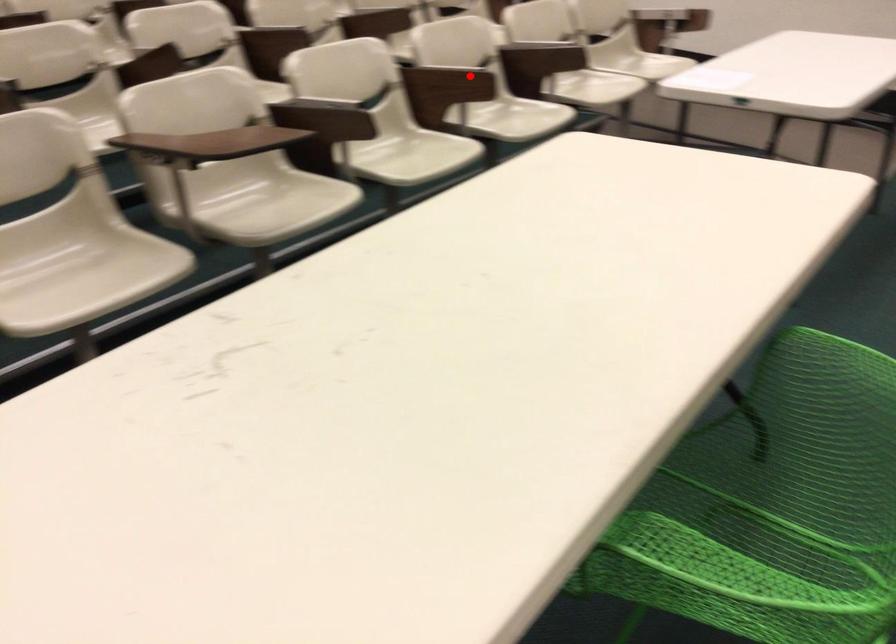
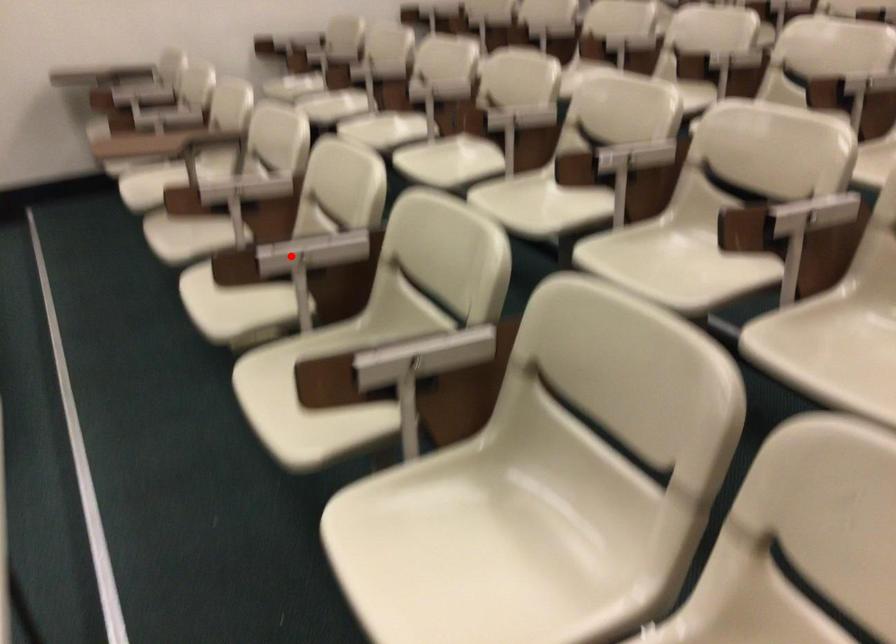
I am providing you with two images of the same scene from different viewpoints. A red point is marked on the first image and another point is marked on the second image. Do the highlighted points in image1 and image2 indicate the same real-world spot?

Yes